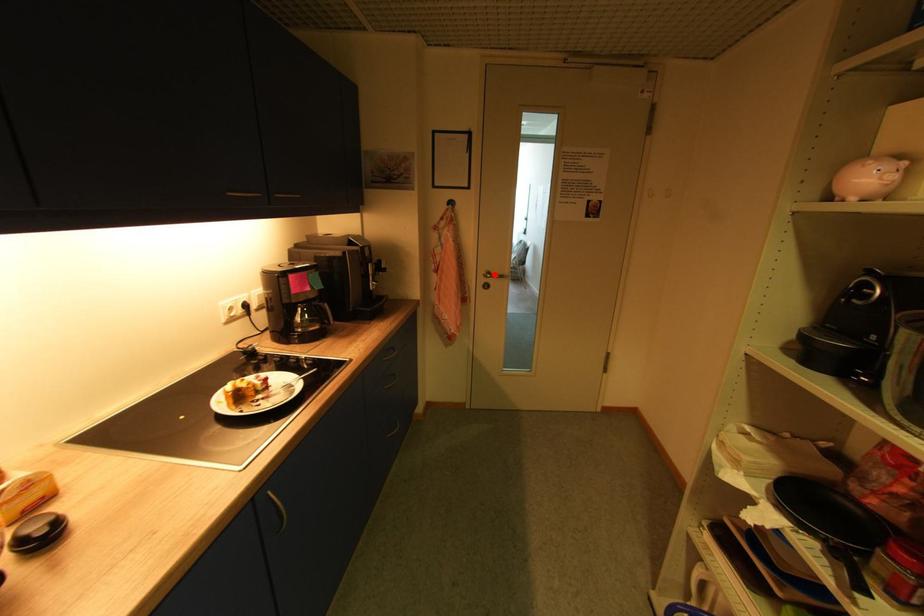
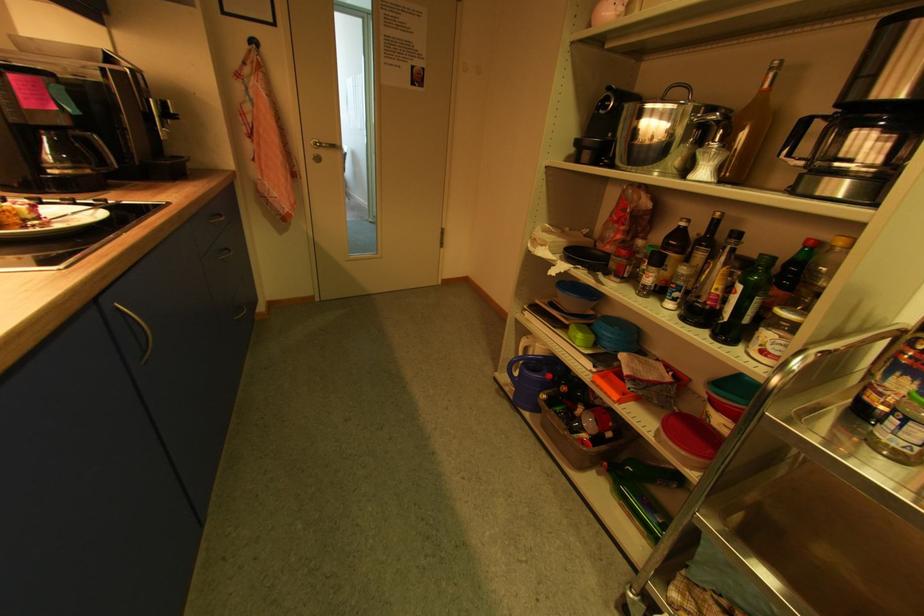
In the second image, find the point that corresponds to the highlighted location in the first image.

(323, 146)